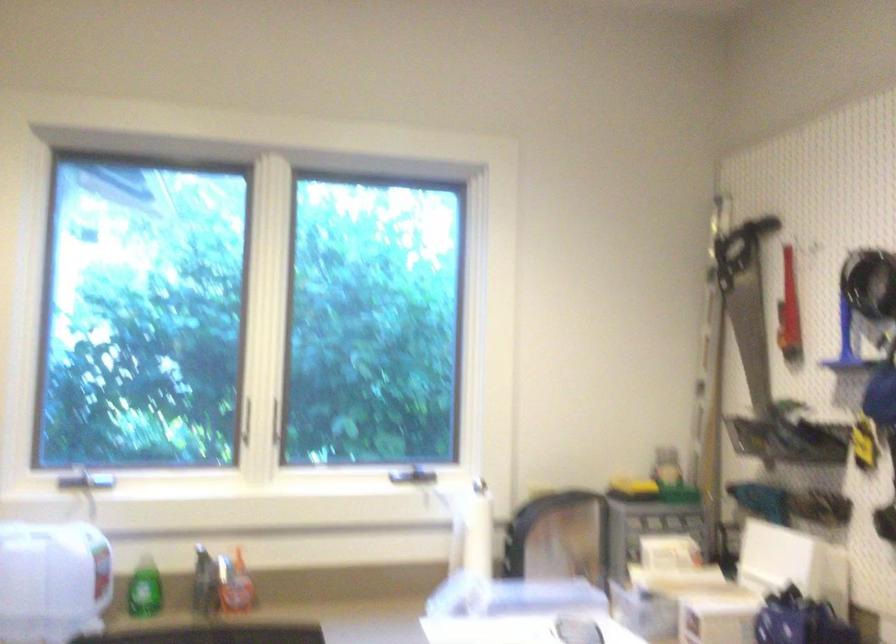
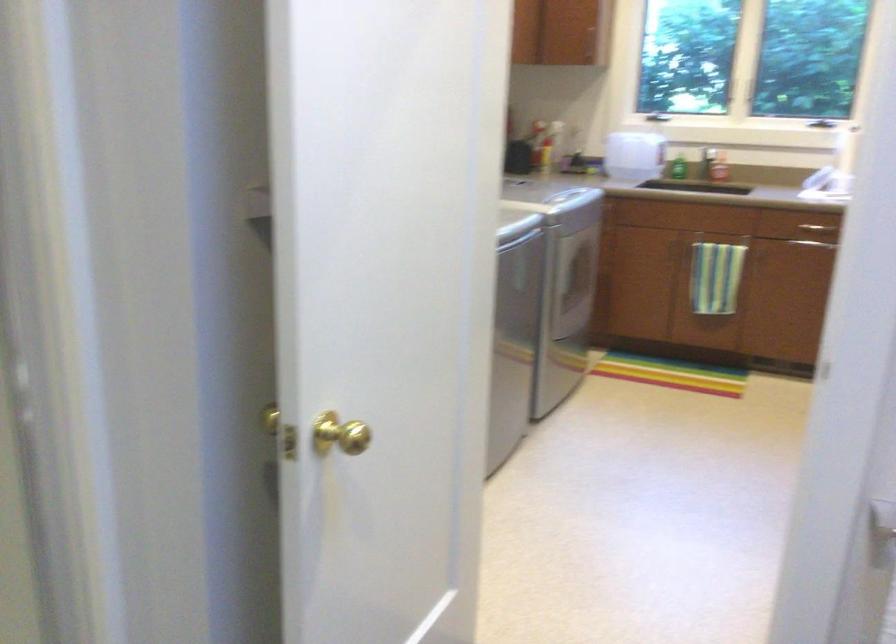
Locate, in the second image, the point that corresponds to point (421, 502) in the first image.

(817, 122)